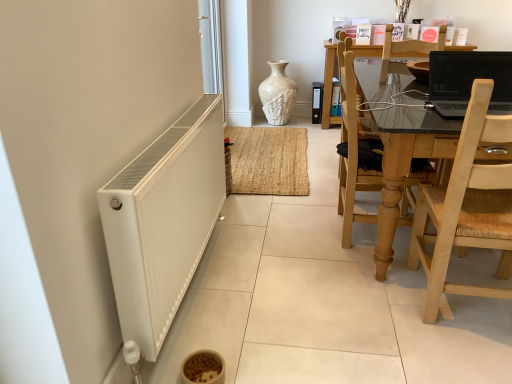
Question: Is wooden chair at right, which is the second chair in front-to-back order, positioned in front of white matte radiator at lower left?

Choices:
 (A) yes
 (B) no

Answer: (B)

Question: From a real-world perspective, is wooden chair at right, which is the second chair in front-to-back order, on white matte radiator at lower left?

Choices:
 (A) no
 (B) yes

Answer: (B)

Question: Can you confirm if wooden chair at right, which is the second chair in front-to-back order, is shorter than white matte radiator at lower left?

Choices:
 (A) yes
 (B) no

Answer: (B)

Question: From the image's perspective, does wooden chair at right, positioned as the first chair in back-to-front order, appear lower than white matte radiator at lower left?

Choices:
 (A) yes
 (B) no

Answer: (B)

Question: Is wooden chair at right, positioned as the first chair in back-to-front order, far from white matte radiator at lower left?

Choices:
 (A) yes
 (B) no

Answer: (B)

Question: Is wooden chair at right, positioned as the first chair in back-to-front order, surrounding white matte radiator at lower left?

Choices:
 (A) yes
 (B) no

Answer: (B)

Question: Considering the relative positions of black glossy laptop at upper right and white textured file cabinet at center in the image provided, is black glossy laptop at upper right in front of white textured file cabinet at center?

Choices:
 (A) no
 (B) yes

Answer: (B)

Question: Is black glossy laptop at upper right beside white textured file cabinet at center?

Choices:
 (A) no
 (B) yes

Answer: (A)

Question: From a real-world perspective, is black glossy laptop at upper right located higher than white textured file cabinet at center?

Choices:
 (A) no
 (B) yes

Answer: (B)

Question: Is black glossy laptop at upper right at the left side of white textured file cabinet at center?

Choices:
 (A) yes
 (B) no

Answer: (B)

Question: From a real-world perspective, is black glossy laptop at upper right beneath white textured file cabinet at center?

Choices:
 (A) no
 (B) yes

Answer: (A)

Question: Can you confirm if black glossy laptop at upper right is wider than white textured file cabinet at center?

Choices:
 (A) no
 (B) yes

Answer: (B)

Question: From a real-world perspective, is white glossy screen door at upper left beneath black glossy laptop at upper right?

Choices:
 (A) no
 (B) yes

Answer: (B)